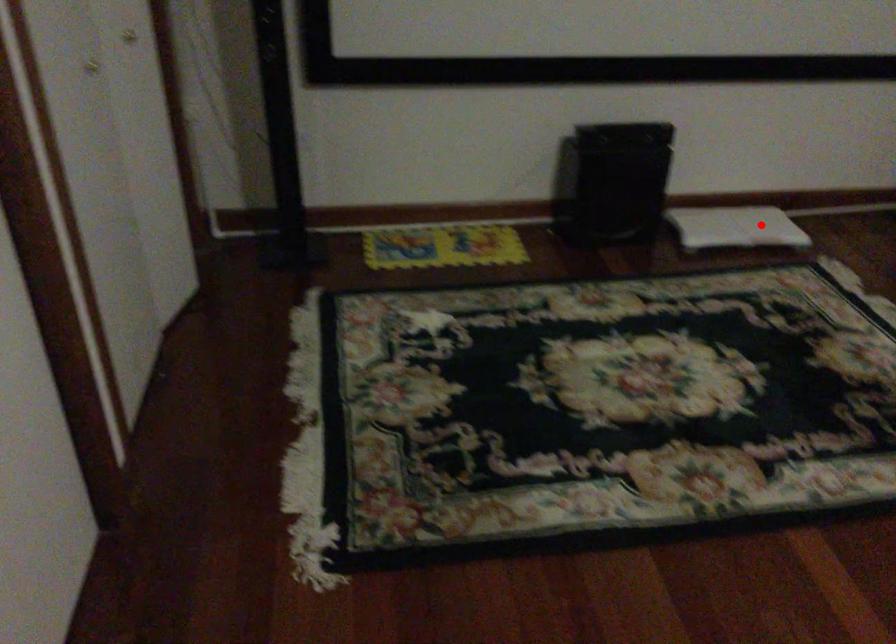
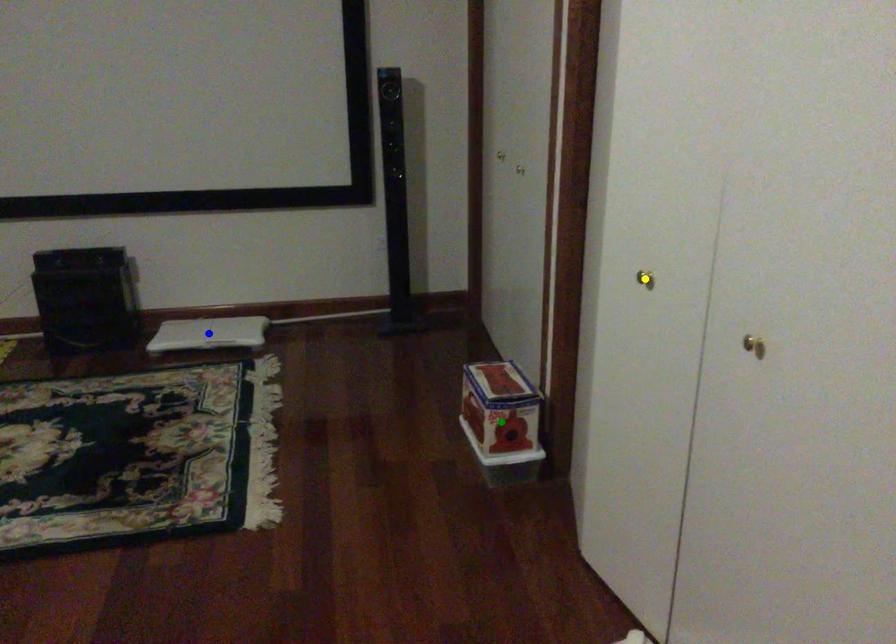
Question: I am providing you with two images of the same scene from different viewpoints. A red point is marked on the first image. You are given multiple points on the second image. Which mark in image 2 goes with the point in image 1?

Choices:
 (A) blue point
 (B) green point
 (C) yellow point

Answer: (A)